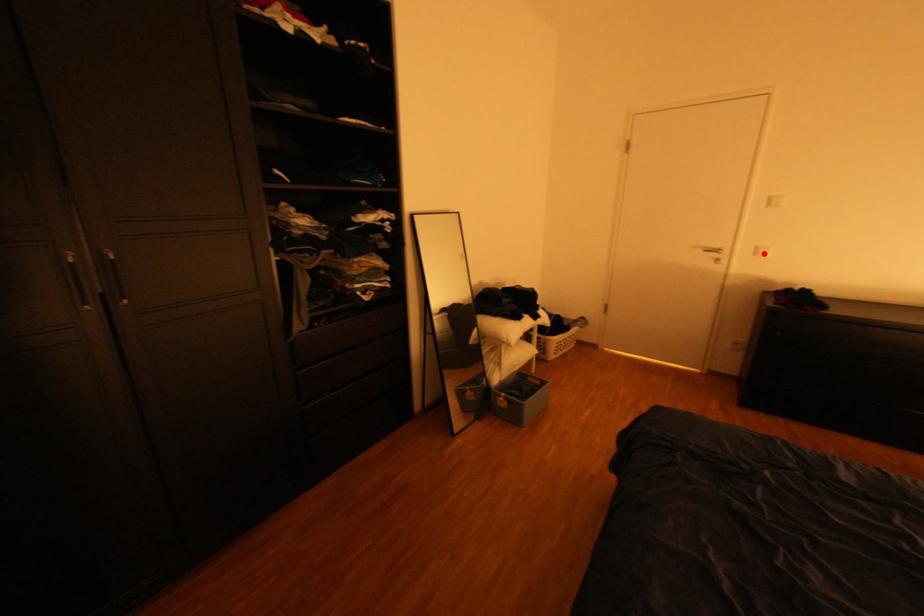
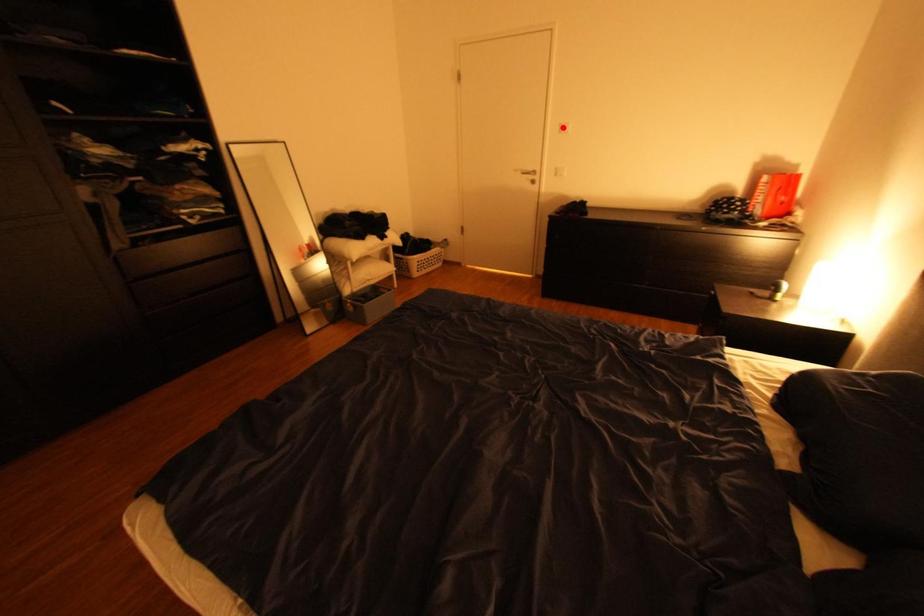
I am providing you with two images of the same scene from different viewpoints. A red point is marked on the first image and another point is marked on the second image. Are the points marked in image1 and image2 representing the same 3D position?

No